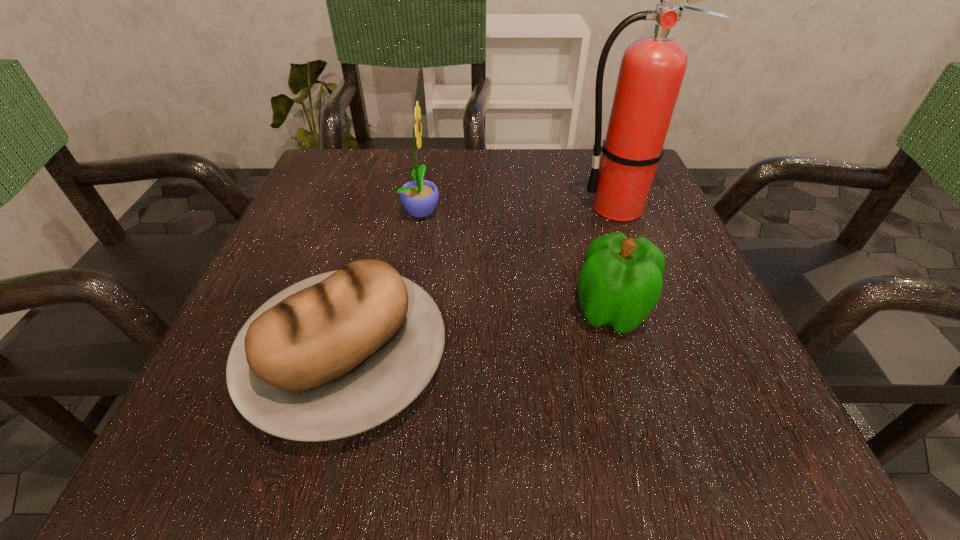
The height and width of the screenshot is (540, 960). Find the location of `vacant area that lies between the bread and the bell pepper`. vacant area that lies between the bread and the bell pepper is located at coordinates (478, 334).

Find the location of a particular element. empty space that is in between the bread and the bell pepper is located at coordinates (478, 334).

Locate an element on the screen. object that is the third closest to the bread is located at coordinates 652,69.

Select which object is the second closest to the bell pepper. Please provide its 2D coordinates. Your answer should be formatted as a tuple, i.e. [(x, y)], where the tuple contains the x and y coordinates of a point satisfying the conditions above.

[(339, 353)]

Identify the location of vacant region that satisfies the following two spatial constraints: 1. on the front-facing side of the sunflower; 2. on the back side of the bell pepper. This screenshot has height=540, width=960. (405, 311).

Image resolution: width=960 pixels, height=540 pixels. In order to click on vacant space that satisfies the following two spatial constraints: 1. on the hose direction of the tallest object; 2. on the front side of the bell pepper in this screenshot , I will do `click(660, 311)`.

Identify the location of free location that satisfies the following two spatial constraints: 1. on the front-facing side of the third shortest object; 2. on the left side of the bell pepper. This screenshot has height=540, width=960. (405, 311).

Find the location of a particular element. This screenshot has width=960, height=540. vacant region that satisfies the following two spatial constraints: 1. on the front-facing side of the third shortest object; 2. on the left side of the bell pepper is located at coordinates (405, 311).

Where is `free space that satisfies the following two spatial constraints: 1. on the front-facing side of the bell pepper; 2. on the left side of the second tallest object`? The height and width of the screenshot is (540, 960). free space that satisfies the following two spatial constraints: 1. on the front-facing side of the bell pepper; 2. on the left side of the second tallest object is located at coordinates (405, 311).

The height and width of the screenshot is (540, 960). I want to click on free point that satisfies the following two spatial constraints: 1. on the front-facing side of the sunflower; 2. on the front side of the bread, so click(398, 356).